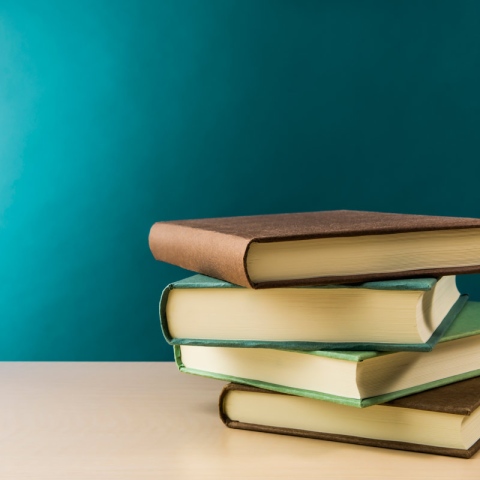
At what (x,y) coordinates should I click in order to perform the action: click on book. Please return your answer as a coordinate pair (x, y). The image size is (480, 480). Looking at the image, I should click on (206, 253), (216, 304), (272, 371), (298, 419).